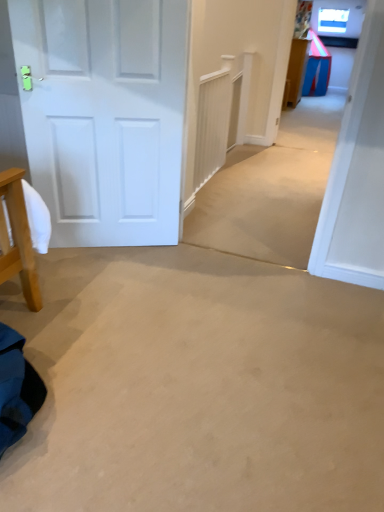
The width and height of the screenshot is (384, 512). Identify the location of white matte door at left. (105, 115).

What do you see at coordinates (105, 115) in the screenshot? I see `white matte door at left` at bounding box center [105, 115].

Image resolution: width=384 pixels, height=512 pixels. Describe the element at coordinates (296, 72) in the screenshot. I see `blue plastic table at upper right` at that location.

Identify the location of blue plastic table at upper right. The image size is (384, 512). (296, 72).

Image resolution: width=384 pixels, height=512 pixels. In order to click on white matte door at left in this screenshot , I will do `click(105, 115)`.

Which object is positioned more to the left, blue plastic table at upper right or white matte door at left?

white matte door at left.

Which is behind, blue plastic table at upper right or white matte door at left?

blue plastic table at upper right is further from the camera.

Considering the points (303, 42) and (127, 30), which point is in front, point (303, 42) or point (127, 30)?

The point (127, 30) is in front.

From the image's perspective, which one is positioned lower, blue plastic table at upper right or white matte door at left?

white matte door at left appears lower in the image.

From a real-world perspective, who is located higher, blue plastic table at upper right or white matte door at left?

white matte door at left, from a real-world perspective.

Can you confirm if blue plastic table at upper right is wider than white matte door at left?

Yes, blue plastic table at upper right is wider than white matte door at left.

Which of these two, blue plastic table at upper right or white matte door at left, stands taller?

With more height is white matte door at left.

Does blue plastic table at upper right have a smaller size compared to white matte door at left?

No.

Is white matte door at left a part of blue plastic table at upper right?

No, white matte door at left is not surrounded by blue plastic table at upper right.

Are blue plastic table at upper right and white matte door at left making contact?

No, blue plastic table at upper right is not next to white matte door at left.

Is blue plastic table at upper right oriented away from white matte door at left?

blue plastic table at upper right does not have its back to white matte door at left.

The height and width of the screenshot is (512, 384). In order to click on table above the white matte door at left (from the image's perspective) in this screenshot , I will do `click(296, 72)`.

Between white matte door at left and blue plastic table at upper right, which one appears on the left side from the viewer's perspective?

Positioned to the left is white matte door at left.

Is white matte door at left in front of blue plastic table at upper right?

Yes, white matte door at left is in front of blue plastic table at upper right.

Is point (95, 180) closer to viewer compared to point (301, 50)?

Yes.

Looking at this image, from the image's perspective, between white matte door at left and blue plastic table at upper right, who is located below?

white matte door at left.

Based on the photo, from a real-world perspective, which object stands above the other?

From a 3D spatial view, white matte door at left is above.

Looking at their sizes, would you say white matte door at left is wider or thinner than blue plastic table at upper right?

white matte door at left is thinner than blue plastic table at upper right.

Considering the sizes of white matte door at left and blue plastic table at upper right in the image, is white matte door at left taller or shorter than blue plastic table at upper right?

In the image, white matte door at left appears to be taller than blue plastic table at upper right.

Which of these two, white matte door at left or blue plastic table at upper right, is bigger?

blue plastic table at upper right is bigger.

Is white matte door at left inside the boundaries of blue plastic table at upper right, or outside?

The correct answer is: outside.

Looking at this image, are white matte door at left and blue plastic table at upper right beside each other?

No, white matte door at left is not beside blue plastic table at upper right.

Consider the image. Is white matte door at left positioned with its back to blue plastic table at upper right?

No, white matte door at left is not facing the opposite direction of blue plastic table at upper right.

How different are the orientations of white matte door at left and blue plastic table at upper right in degrees?

white matte door at left and blue plastic table at upper right are facing 65.1 degrees away from each other.

At what (x,y) coordinates should I click in order to perform the action: click on table below the white matte door at left (from a real-world perspective). Please return your answer as a coordinate pair (x, y). Looking at the image, I should click on (296, 72).

Find the location of a particular element. The image size is (384, 512). door in front of the blue plastic table at upper right is located at coordinates (105, 115).

This screenshot has width=384, height=512. Find the location of `door lying on the left of blue plastic table at upper right`. door lying on the left of blue plastic table at upper right is located at coordinates click(x=105, y=115).